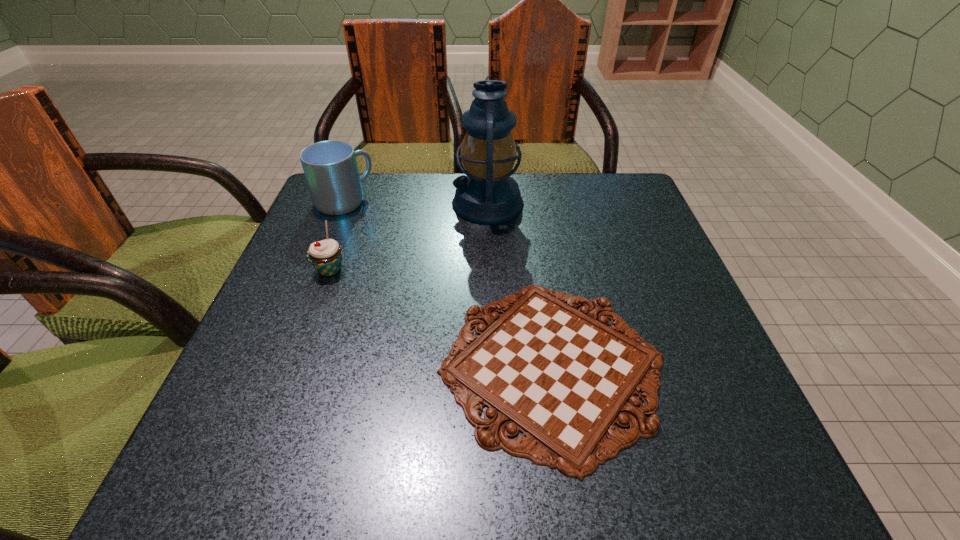
I want to click on lantern, so click(488, 195).

Identify the location of the second tallest object. (330, 167).

Find the location of `the third farthest object`. the third farthest object is located at coordinates (326, 255).

You are a GUI agent. You are given a task and a screenshot of the screen. Output one action in this format:
    pyautogui.click(x=<x>, y=<y>)
    Task: Click on the cupcake
    The image size is (960, 540).
    Given the screenshot: What is the action you would take?
    pyautogui.click(x=326, y=255)

Where is `the nearest object`? the nearest object is located at coordinates (560, 376).

Find the location of a particular element. The width and height of the screenshot is (960, 540). the shortest object is located at coordinates coord(560,376).

Locate an element on the screen. Image resolution: width=960 pixels, height=540 pixels. free point located on the face of the lantern is located at coordinates (349, 204).

Find the location of `vacant region located on the face of the lantern`. vacant region located on the face of the lantern is located at coordinates (362, 204).

At what (x,y) coordinates should I click in order to perform the action: click on vacant region located on the face of the lantern. Please return your answer as a coordinate pair (x, y). The height and width of the screenshot is (540, 960). Looking at the image, I should click on (321, 204).

Identify the location of blank space located 0.320m on the right of the second tallest object. The width and height of the screenshot is (960, 540). (502, 201).